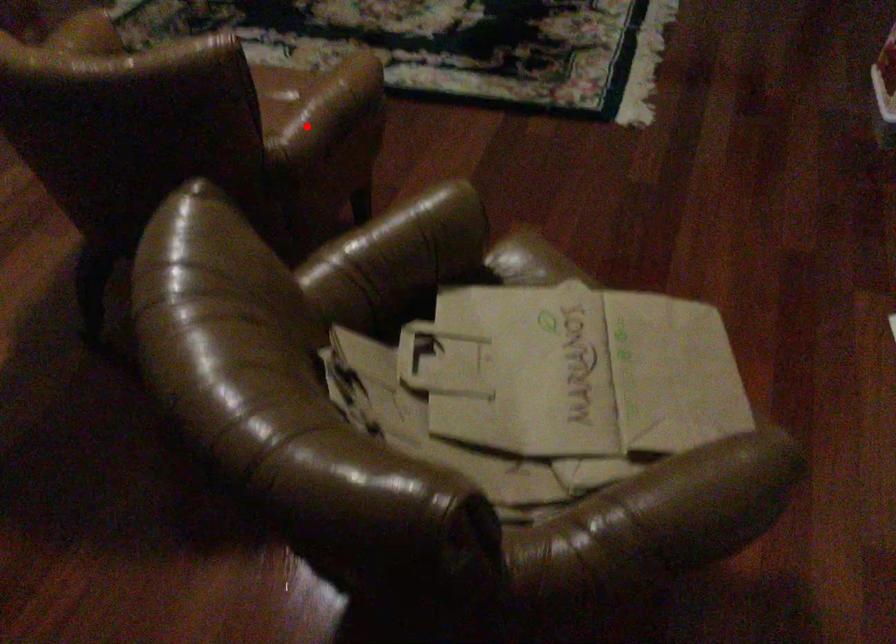
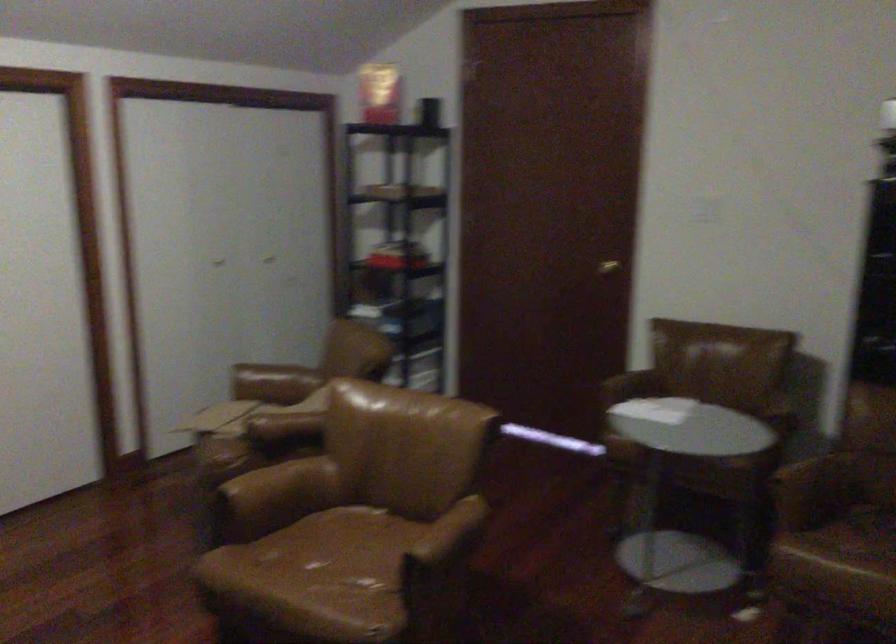
Question: I am providing you with two images of the same scene from different viewpoints. In image1, a red point is highlighted. Considering the same 3D point in image2, which of the following is correct?

Choices:
 (A) It is closer
 (B) It is farther

Answer: (B)